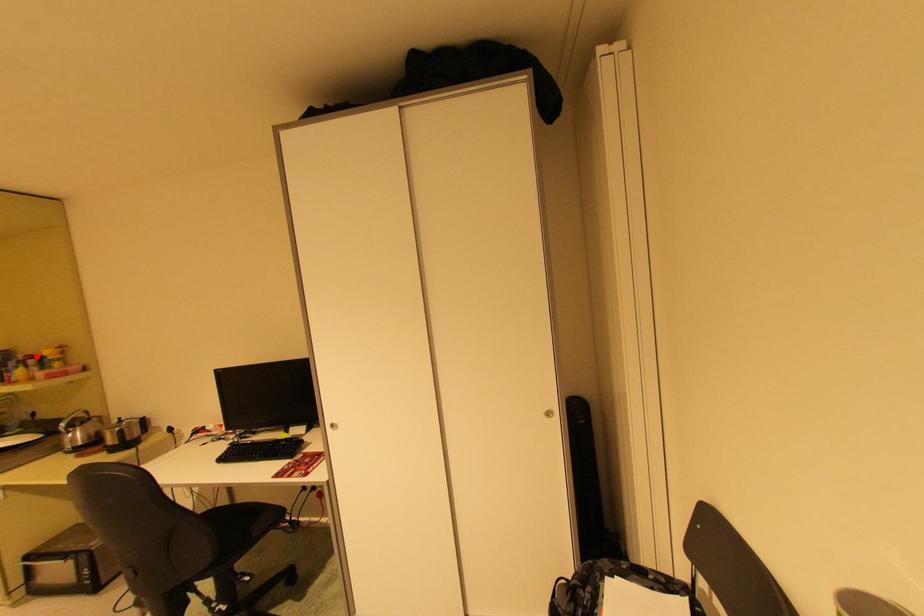
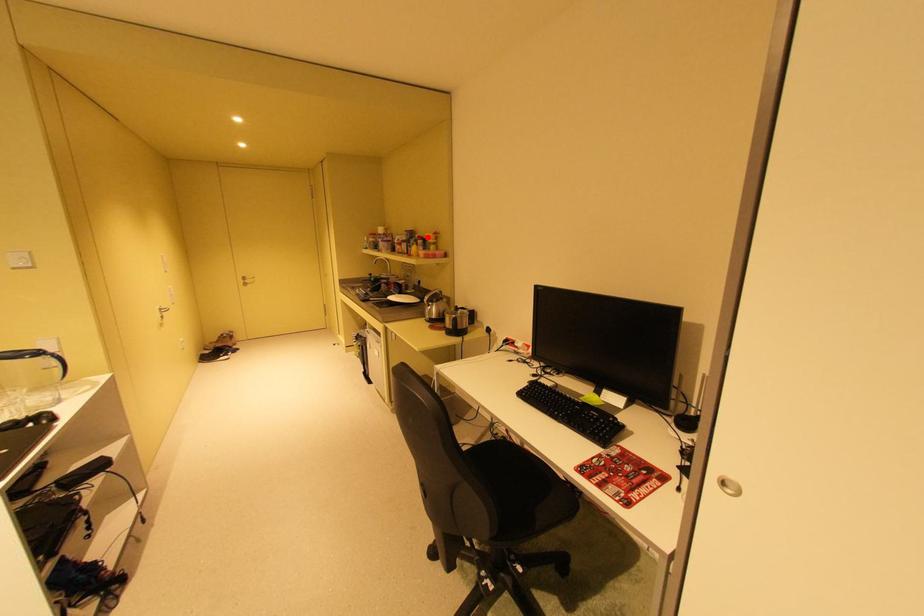
I am providing you with two images of the same scene from different viewpoints. A red point is marked on the first image and another point is marked on the second image. Is the red point in image1 aligned with the point shown in image2?

Yes